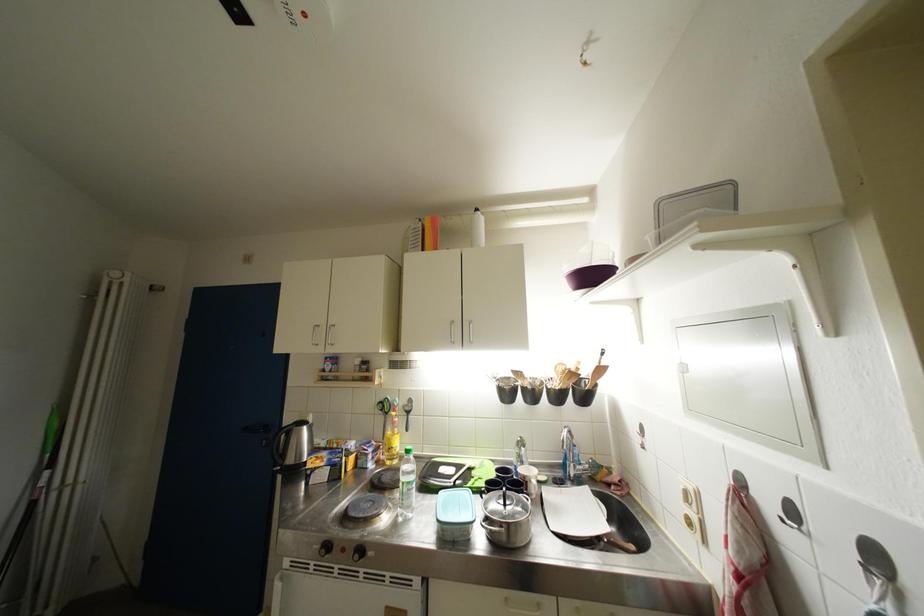
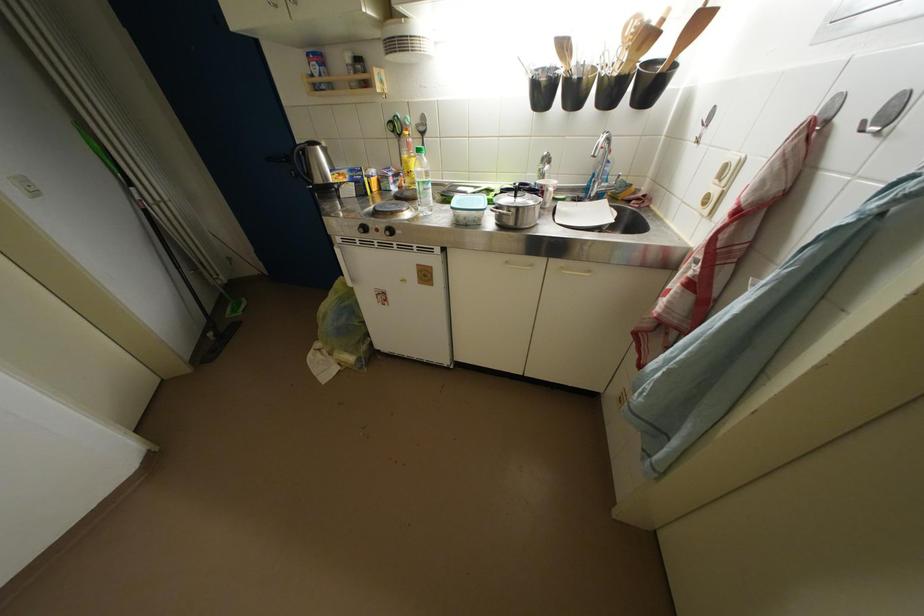
The point at (396, 444) is marked in the first image. Where is the corresponding point in the second image?

(412, 167)